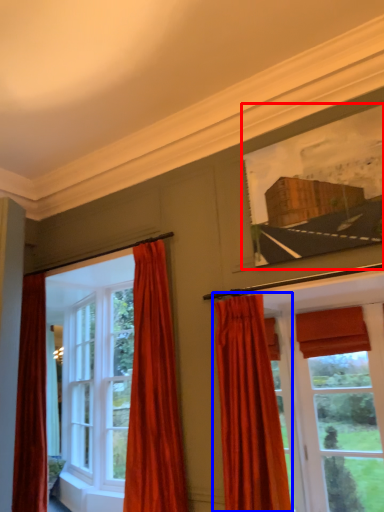
Question: Which of the following is the closest to the observer, picture frame (highlighted by a red box) or curtain (highlighted by a blue box)?

Choices:
 (A) picture frame
 (B) curtain

Answer: (B)